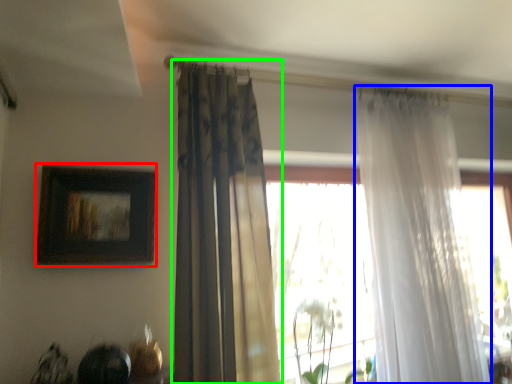
Question: Which object is the farthest from picture frame (highlighted by a red box)? Choose among these: curtain (highlighted by a blue box) or curtain (highlighted by a green box).

Choices:
 (A) curtain
 (B) curtain

Answer: (A)